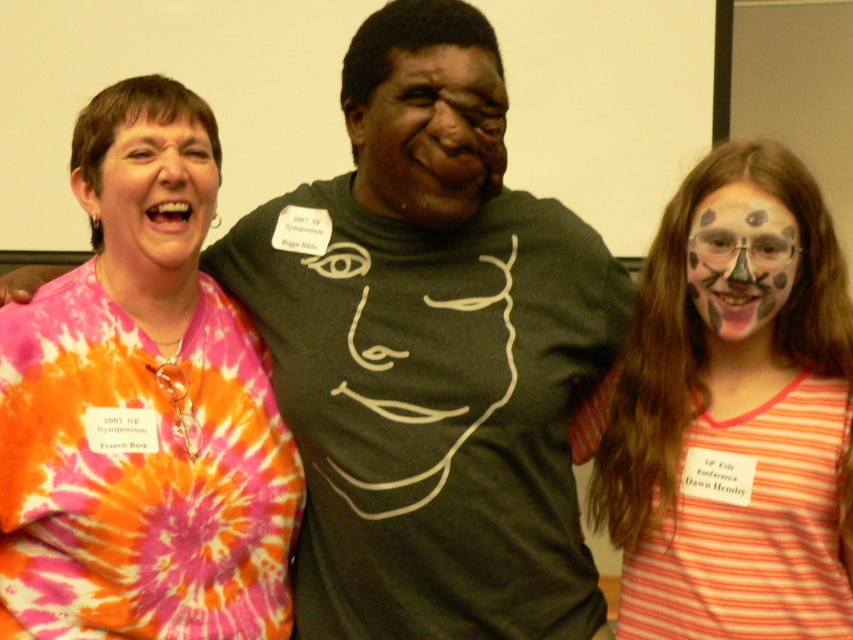
Which is in front, point (425, 64) or point (112, 211)?

Point (425, 64) is more forward.

Who is positioned more to the right, matte black face at center or tie-dye fabric at left?

matte black face at center is more to the right.

Is point (375, 173) closer to camera compared to point (204, 204)?

Yes, it is in front of point (204, 204).

Where is `matte black face at center`? This screenshot has width=853, height=640. matte black face at center is located at coordinates (430, 134).

The height and width of the screenshot is (640, 853). What do you see at coordinates (142, 406) in the screenshot?
I see `tie-dye fabric shirt at left` at bounding box center [142, 406].

Is point (196, 227) farther from camera compared to point (724, 266)?

Yes, point (196, 227) is farther from viewer.

Does point (201, 388) come in front of point (756, 240)?

No, (201, 388) is behind (756, 240).

The image size is (853, 640). I want to click on tie-dye fabric shirt at left, so click(142, 406).

Which of these two, tie-dye fabric shirt at left or matte black face at center, stands taller?

Standing taller between the two is tie-dye fabric shirt at left.

Is tie-dye fabric shirt at left bigger than matte black face at center?

Correct, tie-dye fabric shirt at left is larger in size than matte black face at center.

Which is in front, point (225, 372) or point (421, 92)?

Point (421, 92) is more forward.

You are a GUI agent. You are given a task and a screenshot of the screen. Output one action in this format:
    pyautogui.click(x=<x>, y=<y>)
    Task: Click on the tie-dye fabric shirt at left
    The height and width of the screenshot is (640, 853).
    Given the screenshot: What is the action you would take?
    pyautogui.click(x=142, y=406)